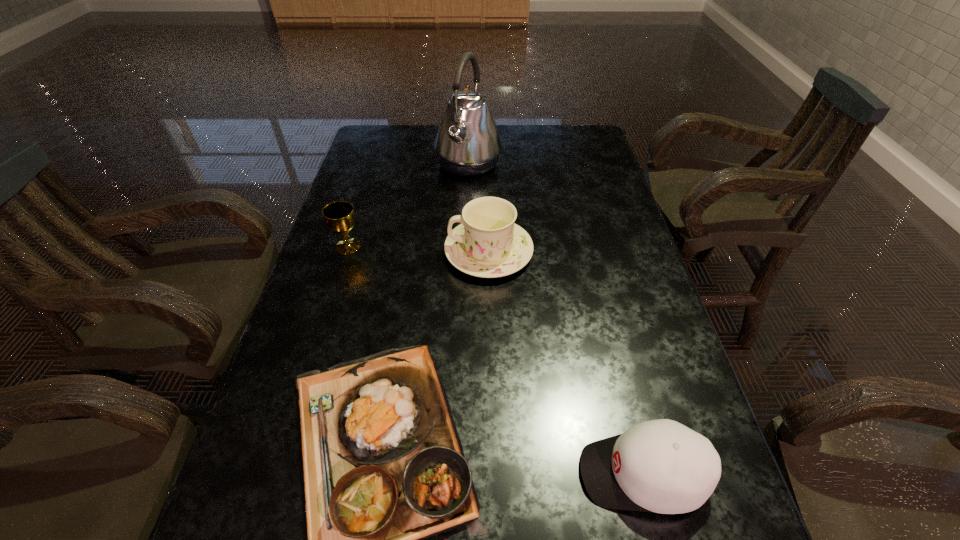
Where is `vacant space located 0.360m on the front-facing side of the baseball cap`? The height and width of the screenshot is (540, 960). vacant space located 0.360m on the front-facing side of the baseball cap is located at coordinates (376, 474).

Locate an element on the screen. vacant space located 0.300m on the front-facing side of the baseball cap is located at coordinates (410, 474).

Find the location of a particular element. This screenshot has width=960, height=540. vacant space located on the front-facing side of the baseball cap is located at coordinates (382, 474).

Find the location of a particular element. The image size is (960, 540). object situated at the far edge is located at coordinates (467, 143).

Locate an element on the screen. object that is at the left edge is located at coordinates (339, 216).

I want to click on object that is at the right edge, so click(661, 466).

Locate an element on the screen. Image resolution: width=960 pixels, height=540 pixels. vacant area at the far edge is located at coordinates (551, 155).

At what (x,y) coordinates should I click in order to perform the action: click on blank area at the left edge. Please return your answer as a coordinate pair (x, y). This screenshot has width=960, height=540. Looking at the image, I should click on coord(348,331).

The image size is (960, 540). What are the coordinates of `vacant region at the right edge of the desktop` in the screenshot? It's located at (580, 163).

You are a GUI agent. You are given a task and a screenshot of the screen. Output one action in this format:
    pyautogui.click(x=<x>, y=<y>)
    Task: Click on the blank area at the far left corner
    The width and height of the screenshot is (960, 540).
    Given the screenshot: What is the action you would take?
    pyautogui.click(x=409, y=131)